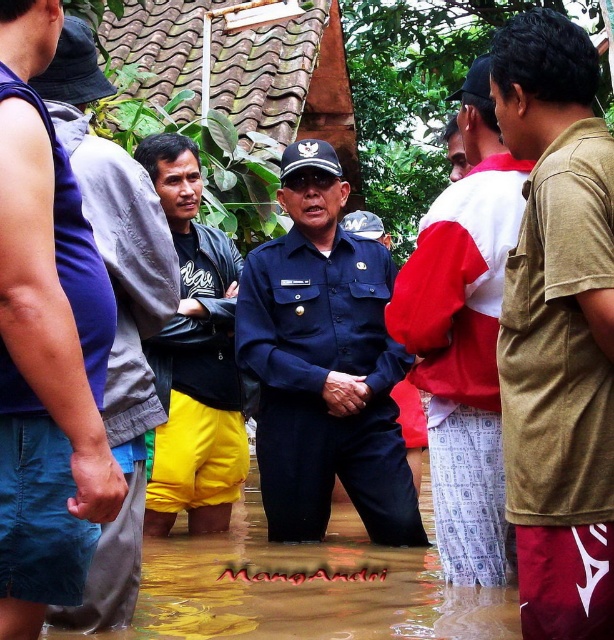
Who is shorter, red and white shirt at center or yellow shorts at left?

With less height is red and white shirt at center.

Measure the distance between point (x=497, y=195) and camera.

Point (x=497, y=195) and camera are 65.99 feet apart from each other.

Image resolution: width=614 pixels, height=640 pixels. I want to click on red and white shirt at center, so click(x=464, y=339).

In the scene shown: Who is taller, brown cotton shirt at right or red and white shirt at center?

red and white shirt at center is taller.

Can you confirm if brown cotton shirt at right is wider than red and white shirt at center?

No, brown cotton shirt at right is not wider than red and white shirt at center.

This screenshot has height=640, width=614. What do you see at coordinates (558, 330) in the screenshot? I see `brown cotton shirt at right` at bounding box center [558, 330].

You are a GUI agent. You are given a task and a screenshot of the screen. Output one action in this format:
    pyautogui.click(x=<x>, y=<y>)
    Task: Click on the brown cotton shirt at right
    The height and width of the screenshot is (640, 614).
    Given the screenshot: What is the action you would take?
    pyautogui.click(x=558, y=330)

Between navy blue uniform at center and yellow shorts at center, which one appears on the left side from the viewer's perspective?

Positioned to the left is yellow shorts at center.

In order to click on navy blue uniform at center in this screenshot , I will do `click(324, 364)`.

Describe the element at coordinates (324, 364) in the screenshot. Image resolution: width=614 pixels, height=640 pixels. I see `navy blue uniform at center` at that location.

The image size is (614, 640). What are the coordinates of `navy blue uniform at center` in the screenshot? It's located at (324, 364).